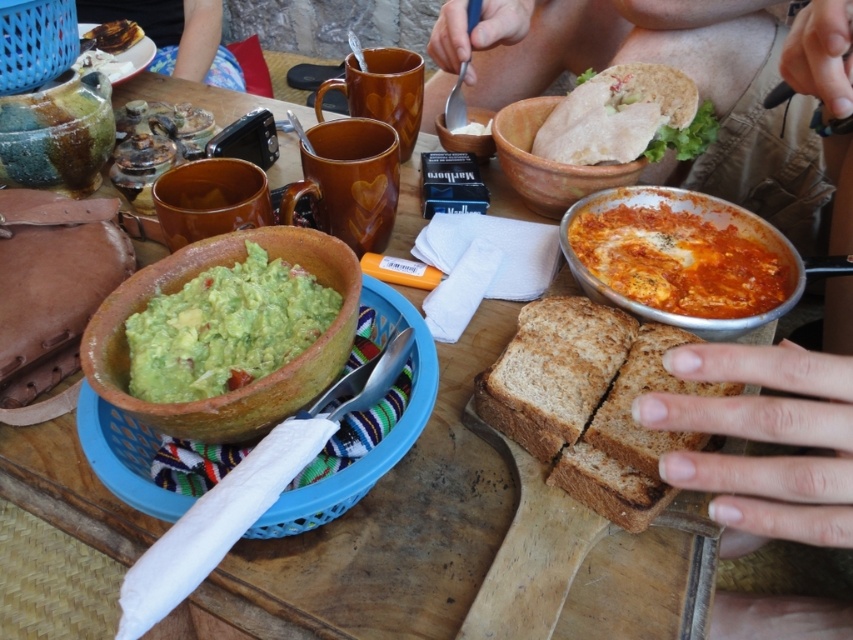
Is point (569, 406) farther from viewer compared to point (543, 212)?

No, (569, 406) is in front of (543, 212).

Between point (538, 360) and point (550, 179), which one is positioned in front?

Positioned in front is point (538, 360).

Locate an element on the screen. Image resolution: width=853 pixels, height=640 pixels. brown matte bread at center is located at coordinates (553, 371).

From the picture: Who is positioned more to the right, matte brown bread at upper right or matte clay bowl at center?

From the viewer's perspective, matte brown bread at upper right appears more on the right side.

Between matte brown bread at upper right and matte clay bowl at center, which one appears on the left side from the viewer's perspective?

matte clay bowl at center is more to the left.

What do you see at coordinates (627, 116) in the screenshot?
I see `matte brown bread at upper right` at bounding box center [627, 116].

Where is `matte brown bread at upper right`? matte brown bread at upper right is located at coordinates (627, 116).

Measure the distance from brown matte bread at center to shiny chocolate bar at upper left.

A distance of 87.45 centimeters exists between brown matte bread at center and shiny chocolate bar at upper left.

Which is behind, point (567, 296) or point (132, 24)?

Positioned behind is point (132, 24).

Between point (526, 387) and point (97, 33), which one is positioned behind?

Point (97, 33)

You are a GUI agent. You are given a task and a screenshot of the screen. Output one action in this format:
    pyautogui.click(x=<x>, y=<y>)
    Task: Click on the brown matte bread at center
    The image size is (853, 640).
    Given the screenshot: What is the action you would take?
    pyautogui.click(x=553, y=371)